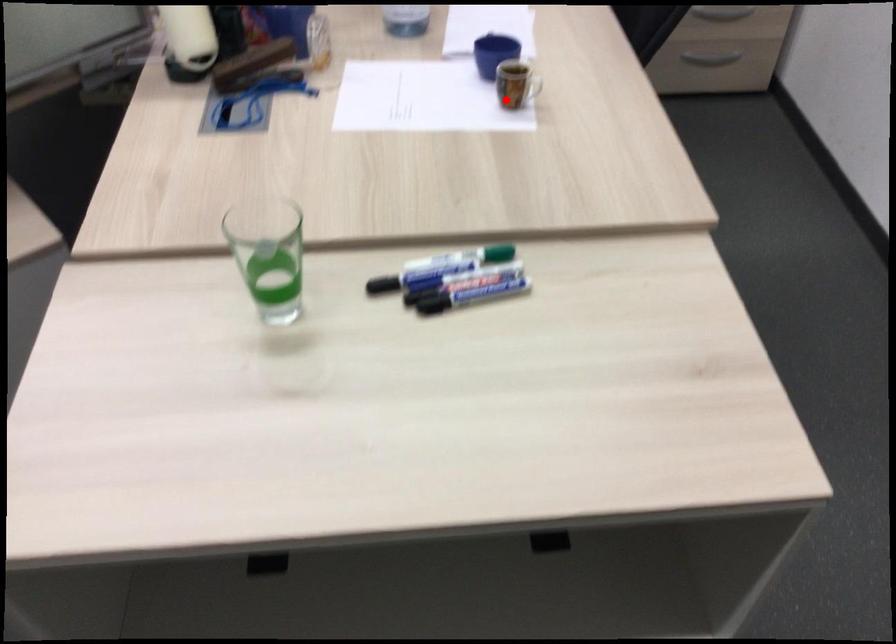
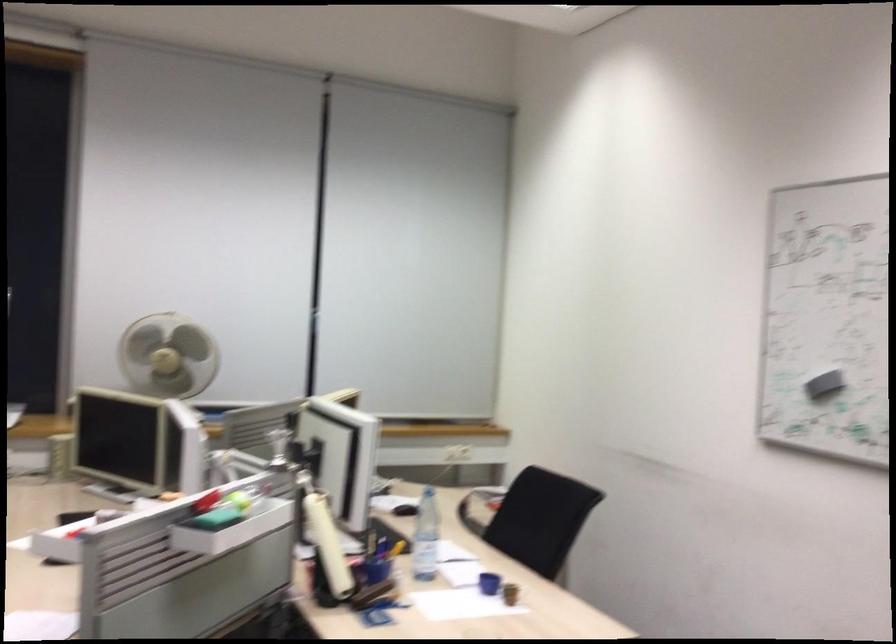
Question: A red point is marked in image1. In image2, is the corresponding 3D point closer to the camera or farther? Reply with the corresponding letter.

Choices:
 (A) The corresponding 3D point is closer.
 (B) The corresponding 3D point is farther.

Answer: (B)